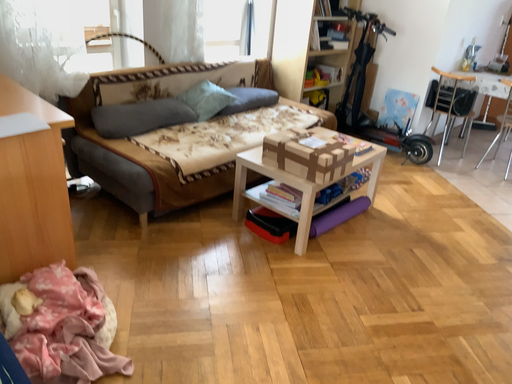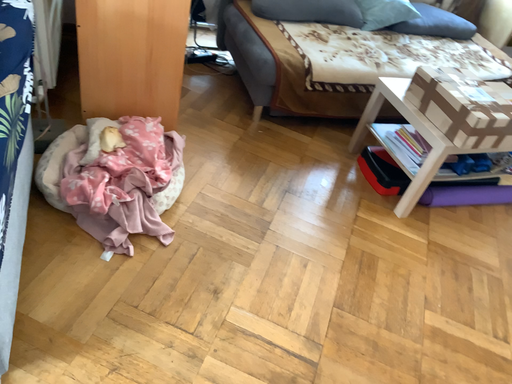
Question: How did the camera likely rotate when shooting the video?

Choices:
 (A) rotated downward
 (B) rotated upward

Answer: (A)